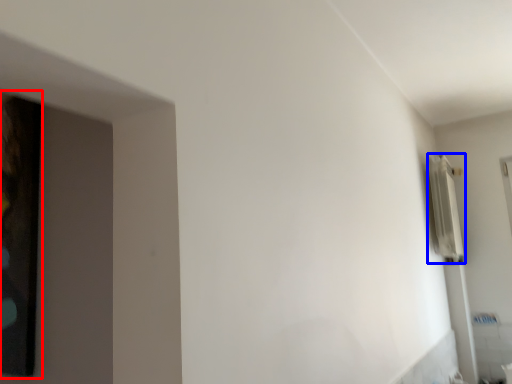
Question: Which object appears farthest to the camera in this image, picture frame (highlighted by a red box) or radiator (highlighted by a blue box)?

Choices:
 (A) picture frame
 (B) radiator

Answer: (B)